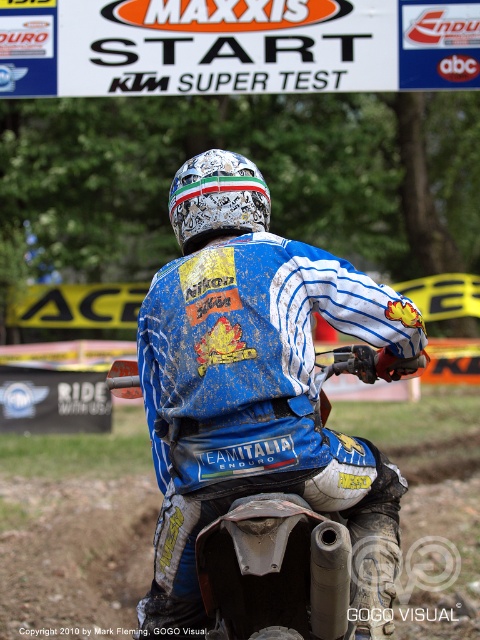
Is blue/white jersey at center in front of shiny metallic helmet at center?

That is True.

Can you confirm if blue/white jersey at center is taller than shiny metallic helmet at center?

Yes, blue/white jersey at center is taller than shiny metallic helmet at center.

Does point (374, 492) lie behind point (243, 202)?

No, it is not.

This screenshot has width=480, height=640. Find the location of `blue/white jersey at center`. blue/white jersey at center is located at coordinates (257, 387).